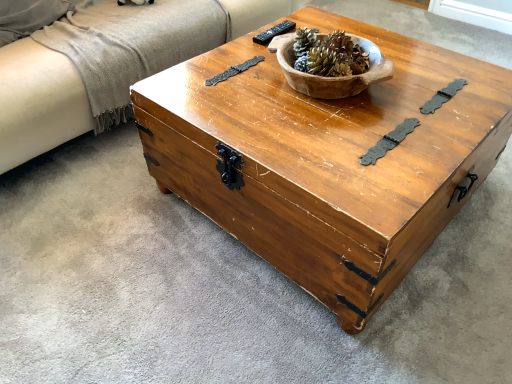
This screenshot has height=384, width=512. What are the coordinates of `free space in front of wooden chest at center` in the screenshot? It's located at (318, 319).